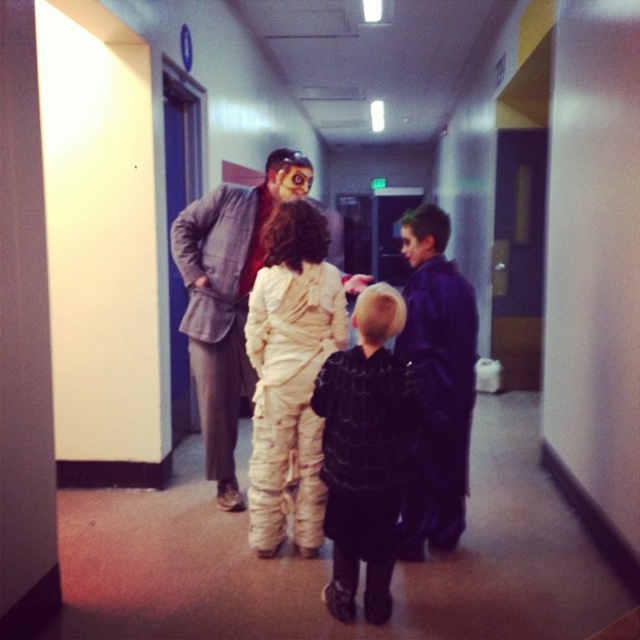
Which is more to the right, black textured coat at center or matte gray suit at center?

From the viewer's perspective, black textured coat at center appears more on the right side.

Where is `black textured coat at center`? black textured coat at center is located at coordinates (365, 452).

Identify the location of black textured coat at center. (365, 452).

Is point (317, 435) farther from camera compared to point (214, 435)?

No, it is not.

Between white mummy at center and matte gray suit at center, which one appears on the right side from the viewer's perspective?

white mummy at center is more to the right.

Does point (257, 460) lie in front of point (250, 252)?

Yes, point (257, 460) is in front of point (250, 252).

Locate an element on the screen. The height and width of the screenshot is (640, 640). white mummy at center is located at coordinates (291, 376).

Between white mummy costume at center and matte gray suit at center, which one appears on the right side from the viewer's perspective?

white mummy costume at center

Looking at this image, between white mummy costume at center and matte gray suit at center, which one is positioned higher?

Positioned higher is matte gray suit at center.

Who is more distant from viewer, (x=243, y=358) or (x=196, y=202)?

Positioned behind is point (x=243, y=358).

Where is `white mummy costume at center`? white mummy costume at center is located at coordinates (240, 289).